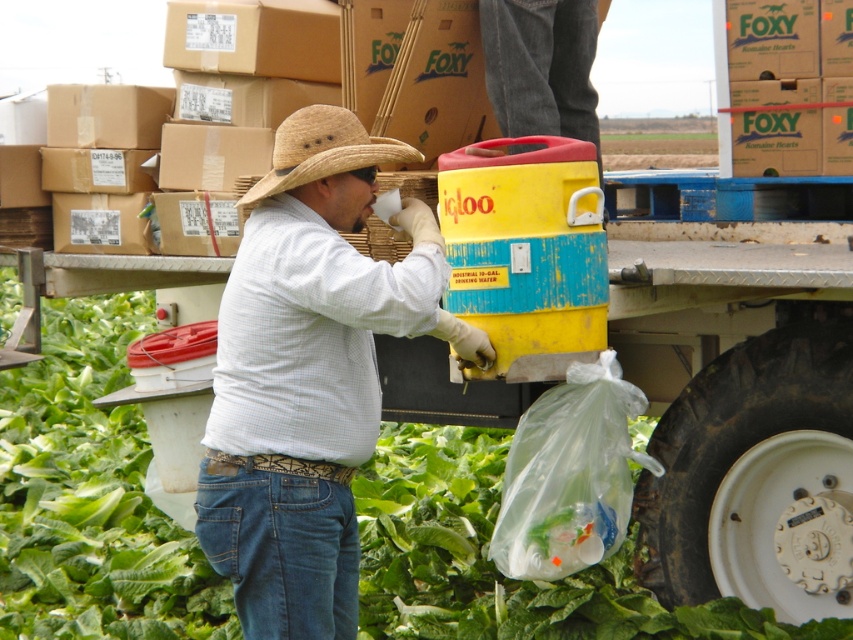
Question: Among these objects, which one is farthest from the camera?

Choices:
 (A) green leafy vegetable at center
 (B) straw hat at center
 (C) matte straw hat at center
 (D) denim jeans at center

Answer: (A)

Question: Does green leafy vegetable at center appear under denim jeans at center?

Choices:
 (A) yes
 (B) no

Answer: (A)

Question: Based on their relative distances, which object is nearer to the green leafy vegetable at center?

Choices:
 (A) matte straw hat at center
 (B) denim jeans at lower center
 (C) straw hat at center

Answer: (B)

Question: Among these objects, which one is farthest from the camera?

Choices:
 (A) straw hat at center
 (B) denim jeans at lower center
 (C) denim jeans at center

Answer: (C)

Question: Is the position of green leafy vegetable at center more distant than that of straw hat at center?

Choices:
 (A) no
 (B) yes

Answer: (B)

Question: Is matte straw hat at center thinner than denim jeans at center?

Choices:
 (A) yes
 (B) no

Answer: (B)